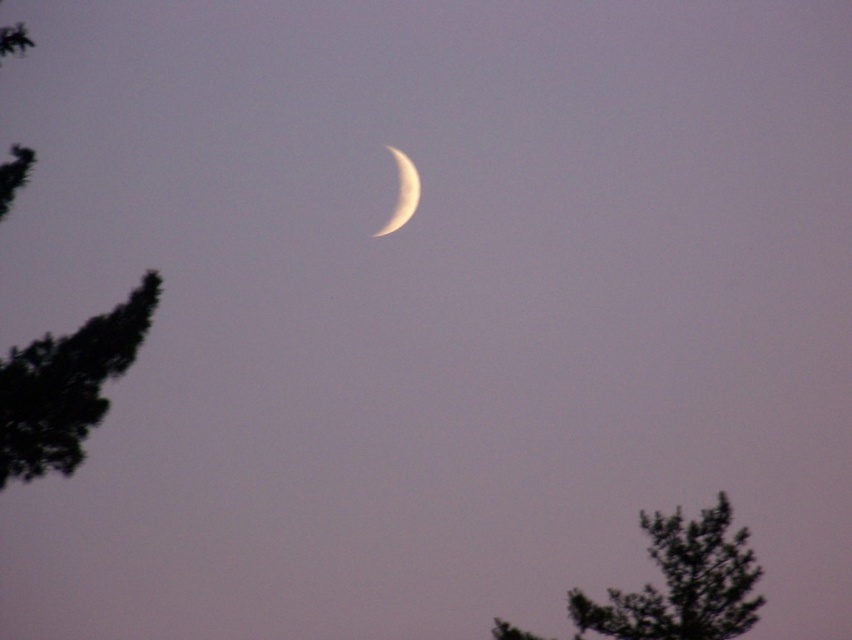
Question: Is green textured tree at lower right bigger than white glossy moon at center?

Choices:
 (A) yes
 (B) no

Answer: (B)

Question: Which of the following is the farthest from the observer?

Choices:
 (A) green leafy tree at left
 (B) green textured tree at lower right
 (C) white glossy moon at center

Answer: (C)

Question: Is green leafy tree at left closer to camera compared to white glossy moon at center?

Choices:
 (A) yes
 (B) no

Answer: (A)

Question: Among these objects, which one is farthest from the camera?

Choices:
 (A) white glossy moon at center
 (B) green textured tree at lower right

Answer: (A)

Question: Is green textured tree at lower right further to camera compared to white glossy moon at center?

Choices:
 (A) no
 (B) yes

Answer: (A)

Question: Which point is farther to the camera?

Choices:
 (A) green leafy tree at left
 (B) green textured tree at lower right

Answer: (B)